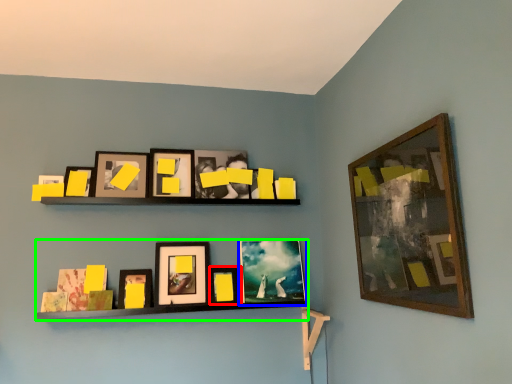
Question: Which is nearer to the picture frame (highlighted by a red box)? picture frame (highlighted by a blue box) or shelf (highlighted by a green box).

Choices:
 (A) picture frame
 (B) shelf

Answer: (A)